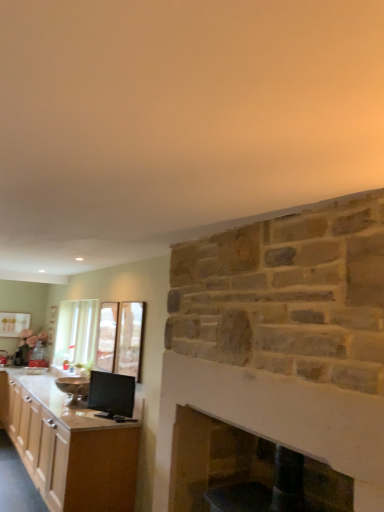
Describe the element at coordinates (276, 419) in the screenshot. I see `smooth stone fireplace at center` at that location.

The width and height of the screenshot is (384, 512). What do you see at coordinates (71, 448) in the screenshot?
I see `wooden cabinet at left` at bounding box center [71, 448].

The width and height of the screenshot is (384, 512). What do you see at coordinates (120, 338) in the screenshot? I see `clear glass door at upper center, acting as the first glass door starting from the right` at bounding box center [120, 338].

At what (x,y) coordinates should I click in order to perform the action: click on smooth stone fireplace at center. Please return your answer as a coordinate pair (x, y). Image resolution: width=384 pixels, height=512 pixels. Looking at the image, I should click on (276, 419).

Is clear glass door at upper center, placed as the 2th glass door when sorted from back to front, not inside clear glass door at center, which is the first glass door from back to front?

Absolutely, clear glass door at upper center, placed as the 2th glass door when sorted from back to front, is external to clear glass door at center, which is the first glass door from back to front.

From the image's perspective, which one is positioned lower, clear glass door at upper center, which appears as the first glass door when viewed from the front, or clear glass door at center, which is the first glass door from left to right?

clear glass door at center, which is the first glass door from left to right.

Considering the points (124, 350) and (104, 350), which point is behind, point (124, 350) or point (104, 350)?

Positioned behind is point (104, 350).

Is clear glass door at upper center, the 2th glass door viewed from the left, to the left or to the right of clear glass door at center, the 2th glass door positioned from the right, in the image?

Clearly, clear glass door at upper center, the 2th glass door viewed from the left, is on the right of clear glass door at center, the 2th glass door positioned from the right, in the image.

Does matte black monitor at lower left, which ranks as the 1th appliance in front-to-back order, have a greater height compared to clear glass door at center, which is the first glass door from left to right?

No.

Considering the sizes of objects matte black monitor at lower left, acting as the first appliance starting from the right, and clear glass door at center, arranged as the 2th glass door when viewed from the front, in the image provided, who is bigger, matte black monitor at lower left, acting as the first appliance starting from the right, or clear glass door at center, arranged as the 2th glass door when viewed from the front,?

matte black monitor at lower left, acting as the first appliance starting from the right, is bigger.

Would you consider matte black monitor at lower left, positioned as the 2th appliance in left-to-right order, to be distant from clear glass door at center, which is the first glass door from back to front?

They are positioned close to each other.

From a real-world perspective, is matte black monitor at lower left, which ranks as the 1th appliance in front-to-back order, located higher than clear glass door at center, arranged as the 2th glass door when viewed from the front?

No, from a real-world perspective, matte black monitor at lower left, which ranks as the 1th appliance in front-to-back order, is not above clear glass door at center, arranged as the 2th glass door when viewed from the front.

Considering the sizes of smooth stone fireplace at center and wooden cabinet at left in the image, is smooth stone fireplace at center bigger or smaller than wooden cabinet at left?

In the image, smooth stone fireplace at center appears to be smaller than wooden cabinet at left.

From the image's perspective, is smooth stone fireplace at center located above or below wooden cabinet at left?

smooth stone fireplace at center is situated higher than wooden cabinet at left in the image.

I want to click on cabinetry lying behind the smooth stone fireplace at center, so click(x=71, y=448).

Measure the distance between smooth stone fireplace at center and wooden cabinet at left.

They are 1.64 meters apart.

Would you say matte black monitor at lower left, acting as the first appliance starting from the right, is part of wooden cabinet at left's contents?

No, matte black monitor at lower left, acting as the first appliance starting from the right, is not inside wooden cabinet at left.

Locate an element on the screen. appliance that is the 1st one when counting backward from the wooden cabinet at left is located at coordinates (112, 393).

Is point (125, 403) positioned before point (109, 332)?

That is True.

Could you measure the distance between matte black monitor at lower left, which ranks as the 1th appliance in front-to-back order, and clear glass door at upper center, acting as the first glass door starting from the right?

They are 34.71 centimeters apart.

Is matte black monitor at lower left, which ranks as the 1th appliance in front-to-back order, aimed at clear glass door at upper center, placed as the 2th glass door when sorted from back to front?

No.

Would you say clear glass door at upper center, the 2th glass door viewed from the left, contains wooden cabinet at left?

No, wooden cabinet at left is located outside of clear glass door at upper center, the 2th glass door viewed from the left.

Identify the location of glass door that is the 2nd object located above the wooden cabinet at left (from the image's perspective). (120, 338).

Is clear glass door at upper center, the 2th glass door viewed from the left, aimed at wooden cabinet at left?

No, clear glass door at upper center, the 2th glass door viewed from the left, is not aimed at wooden cabinet at left.

Based on their positions, is clear glass door at center, the 2th glass door positioned from the right, located to the left or right of metallic silver bowl at left, which is counted as the 1th appliance, starting from the left?

clear glass door at center, the 2th glass door positioned from the right, is to the right of metallic silver bowl at left, which is counted as the 1th appliance, starting from the left.

Can you confirm if clear glass door at center, which is the first glass door from left to right, is bigger than metallic silver bowl at left, the first appliance in the back-to-front sequence?

Incorrect, clear glass door at center, which is the first glass door from left to right, is not larger than metallic silver bowl at left, the first appliance in the back-to-front sequence.

From a real-world perspective, is clear glass door at center, which is the first glass door from back to front, under metallic silver bowl at left, the first appliance in the back-to-front sequence?

Incorrect, from a real-world perspective, clear glass door at center, which is the first glass door from back to front, is higher than metallic silver bowl at left, the first appliance in the back-to-front sequence.

Locate an element on the screen. glass door directly beneath the clear glass door at center, the 2th glass door positioned from the right (from a real-world perspective) is located at coordinates (120, 338).

From a real-world perspective, starting from the matte black monitor at lower left, which ranks as the 1th appliance in front-to-back order, which glass door is the 2nd one vertically above it? Please provide its 2D coordinates.

[(107, 336)]

In the scene shown: Based on their spatial positions, is matte black monitor at lower left, which ranks as the 1th appliance in front-to-back order, or clear glass door at center, which is the first glass door from left to right, closer to wooden cabinet at left?

The object closer to wooden cabinet at left is matte black monitor at lower left, which ranks as the 1th appliance in front-to-back order.

When comparing their distances from smooth stone fireplace at center, does wooden cabinet at left or clear glass door at upper center, the 2th glass door viewed from the left, seem further?

wooden cabinet at left lies further to smooth stone fireplace at center than the other object.

Based on their spatial positions, is smooth stone fireplace at center or matte black monitor at lower left, acting as the first appliance starting from the right, closer to clear glass door at center, the 2th glass door positioned from the right?

matte black monitor at lower left, acting as the first appliance starting from the right, is closer to clear glass door at center, the 2th glass door positioned from the right.

Based on their spatial positions, is clear glass door at upper center, placed as the 2th glass door when sorted from back to front, or smooth stone fireplace at center further from clear glass door at center, arranged as the 2th glass door when viewed from the front?

smooth stone fireplace at center lies further to clear glass door at center, arranged as the 2th glass door when viewed from the front, than the other object.

Estimate the real-world distances between objects in this image. Which object is further from clear glass door at upper center, acting as the first glass door starting from the right, clear glass door at center, arranged as the 2th glass door when viewed from the front, or matte black monitor at lower left, which appears as the second appliance when viewed from the back?

Based on the image, matte black monitor at lower left, which appears as the second appliance when viewed from the back, appears to be further to clear glass door at upper center, acting as the first glass door starting from the right.

Estimate the real-world distances between objects in this image. Which object is closer to clear glass door at center, arranged as the 2th glass door when viewed from the front, smooth stone fireplace at center or metallic silver bowl at left, placed as the second appliance when sorted from right to left?

Based on the image, metallic silver bowl at left, placed as the second appliance when sorted from right to left, appears to be nearer to clear glass door at center, arranged as the 2th glass door when viewed from the front.

Looking at the image, which one is located further to smooth stone fireplace at center, clear glass door at center, which is the first glass door from left to right, or clear glass door at upper center, placed as the 2th glass door when sorted from back to front?

Among the two, clear glass door at center, which is the first glass door from left to right, is located further to smooth stone fireplace at center.

Which object lies nearer to the anchor point matte black monitor at lower left, which appears as the second appliance when viewed from the back, smooth stone fireplace at center or wooden cabinet at left?

Among the two, wooden cabinet at left is located nearer to matte black monitor at lower left, which appears as the second appliance when viewed from the back.

This screenshot has width=384, height=512. I want to click on appliance between matte black monitor at lower left, acting as the first appliance starting from the right, and clear glass door at center, which is the first glass door from back to front, from front to back, so click(73, 388).

Where is `glass door between clear glass door at upper center, placed as the 2th glass door when sorted from back to front, and metallic silver bowl at left, placed as the second appliance when sorted from right to left, from top to bottom`? glass door between clear glass door at upper center, placed as the 2th glass door when sorted from back to front, and metallic silver bowl at left, placed as the second appliance when sorted from right to left, from top to bottom is located at coordinates (107, 336).

Where is `cabinetry between smooth stone fireplace at center and clear glass door at center, which is the first glass door from back to front, from front to back`? The width and height of the screenshot is (384, 512). cabinetry between smooth stone fireplace at center and clear glass door at center, which is the first glass door from back to front, from front to back is located at coordinates (71, 448).

Locate an element on the screen. glass door between smooth stone fireplace at center and metallic silver bowl at left, which is counted as the 1th appliance, starting from the left, from front to back is located at coordinates (120, 338).